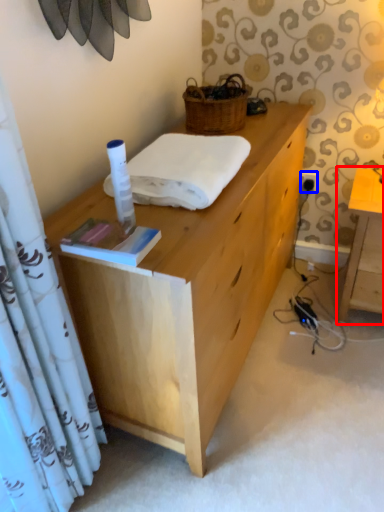
Question: Which point is closer to the camera, table (highlighted by a red box) or power outlet (highlighted by a blue box)?

Choices:
 (A) table
 (B) power outlet

Answer: (A)